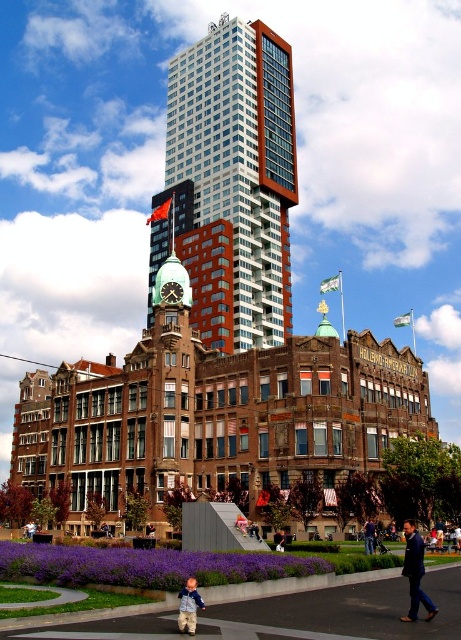
You are a city planner evaluating the urban layout. Given the white glass skyscraper at center and the dark blue jeans at lower center, which structure is taller?

The white glass skyscraper at center is taller than the dark blue jeans at lower center according to the description.

You are standing at the entrance of a park and want to take a photo of the white glass skyscraper at center. The park is 100 meters away from the skyscraper. Do you need to move closer to capture the entire building in your camera frame?

The white glass skyscraper at center is 89.45 meters away from the camera. Since the park is 100 meters away from the skyscraper, your current position is 189.45 meters away from the skyscraper. To capture the entire building in your camera frame, you would need to move closer.

You are standing in the urban scene and want to take a photo that includes both the modern red and white building and the historic brown brick building with the clock tower. Which point, point (x=417, y=593) or point (x=195, y=589), should you focus on to ensure both buildings are clearly visible in your shot?

You should focus on point (x=195, y=589) because it is closer to the historic brown brick building with the clock tower and the modern red and white building, allowing both to be in clear view.